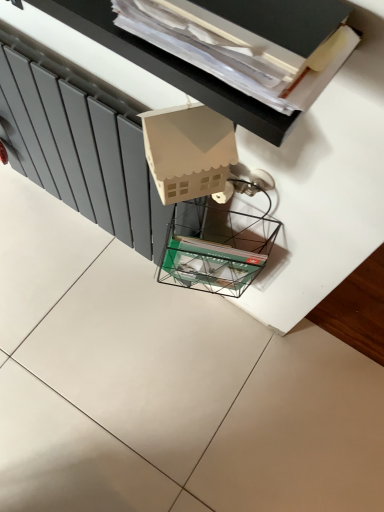
Where is `vacant space situated above matte gray radiator at left (from a real-world perspective)`? vacant space situated above matte gray radiator at left (from a real-world perspective) is located at coordinates [x=73, y=78].